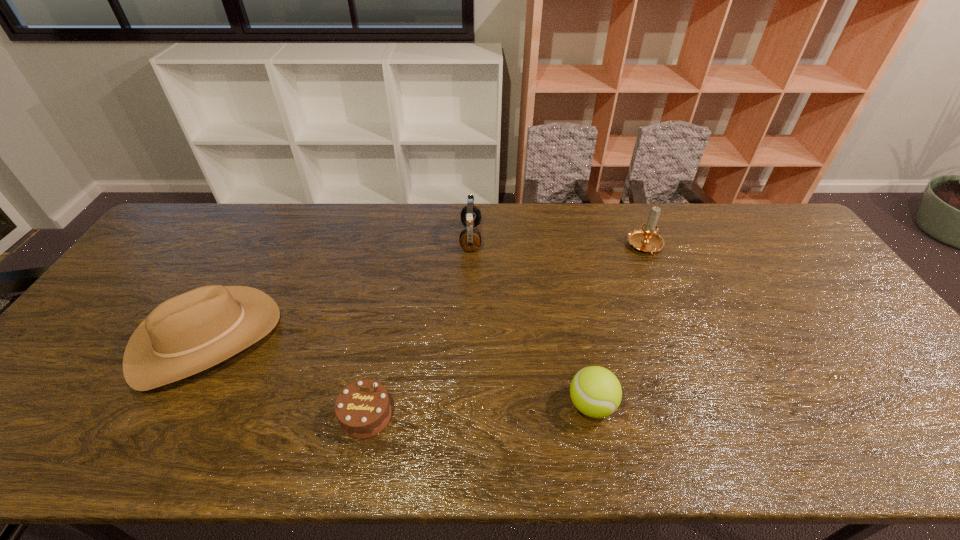
Locate an element on the screen. This screenshot has height=540, width=960. vacant area at the far left corner of the desktop is located at coordinates (178, 218).

Locate an element on the screen. vacant space at the far right corner of the desktop is located at coordinates (777, 235).

Find the location of a particular element. vacant area at the near right corner of the desktop is located at coordinates (926, 455).

Locate an element on the screen. The width and height of the screenshot is (960, 540). free spot between the fourth object from right to left and the headset is located at coordinates (419, 327).

Where is `vacant space that's between the cowboy hat and the candle`? vacant space that's between the cowboy hat and the candle is located at coordinates [426, 293].

The height and width of the screenshot is (540, 960). In order to click on free space between the fourth tallest object and the rightmost object in this screenshot , I will do `click(618, 326)`.

Find the location of a particular element. vacant area that lies between the rightmost object and the leftmost object is located at coordinates (426, 293).

This screenshot has width=960, height=540. I want to click on free point between the candle and the fourth object from right to left, so click(x=506, y=332).

You are a GUI agent. You are given a task and a screenshot of the screen. Output one action in this format:
    pyautogui.click(x=<x>, y=<y>)
    Task: Click on the empty space between the headset and the fourth object from right to left
    This screenshot has width=960, height=540.
    Given the screenshot: What is the action you would take?
    pyautogui.click(x=419, y=327)

Locate an element on the screen. Image resolution: width=960 pixels, height=540 pixels. free space that is in between the rightmost object and the leftmost object is located at coordinates (426, 293).